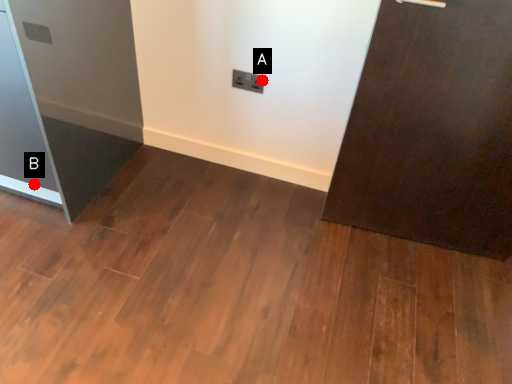
Question: Two points are circled on the image, labeled by A and B beside each circle. Which of the following is the farthest from the observer?

Choices:
 (A) A is further
 (B) B is further

Answer: (A)